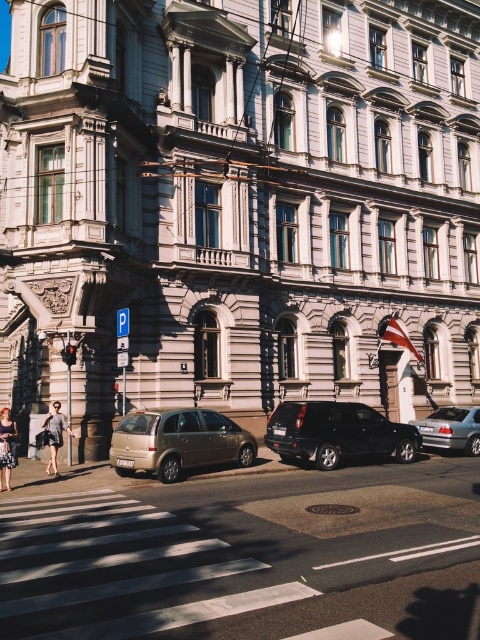
You are standing at the crosswalk in front of the grand building and notice two points marked on the road. Which point is closer to you, point (144,456) or point (385,444)?

Point (144,456) is closer to the viewer than point (385,444).

You are standing at the pedestrian crossing in front of the grand building. You want to walk to the gold metallic minivan at center. Approximately how far will you have to walk to reach it?

The gold metallic minivan at center is 36.94 meters away from the viewer, so you will have to walk approximately 36.94 meters to reach it.

You are standing on the sidewalk in front of the grand building and notice the white asphalt at center and the matte black dress at lower left. Which object is closer to the ground?

The white asphalt at center is closer to the ground because it has a lesser height compared to the matte black dress at lower left.